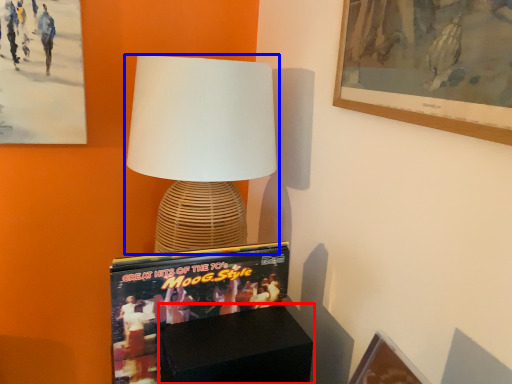
Question: Among these objects, which one is farthest to the camera, furniture (highlighted by a red box) or lamp (highlighted by a blue box)?

Choices:
 (A) furniture
 (B) lamp

Answer: (B)